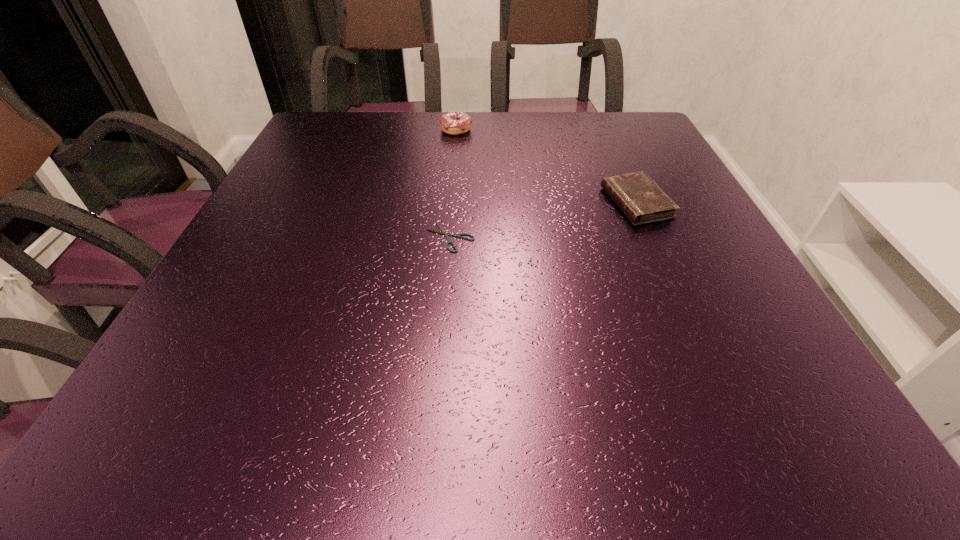
In the image, there is a desktop. Where is `free space at the far edge`? free space at the far edge is located at coordinates (547, 127).

This screenshot has height=540, width=960. I want to click on vacant space at the near edge, so click(x=552, y=414).

Image resolution: width=960 pixels, height=540 pixels. I want to click on vacant area at the left edge of the desktop, so 276,202.

This screenshot has width=960, height=540. In order to click on vacant region at the right edge of the desktop in this screenshot , I will do `click(670, 251)`.

You are a GUI agent. You are given a task and a screenshot of the screen. Output one action in this format:
    pyautogui.click(x=<x>, y=<y>)
    Task: Click on the vacant space at the far right corner of the desktop
    The height and width of the screenshot is (540, 960).
    Given the screenshot: What is the action you would take?
    pyautogui.click(x=631, y=125)

The height and width of the screenshot is (540, 960). Identify the location of vacant area that lies between the doughnut and the diary. (546, 166).

At what (x,y) coordinates should I click in order to perform the action: click on free space between the doughnut and the second shortest object. Please return your answer as a coordinate pair (x, y). Image resolution: width=960 pixels, height=540 pixels. Looking at the image, I should click on (546, 166).

At what (x,y) coordinates should I click in order to perform the action: click on free space between the doughnut and the shears. Please return your answer as a coordinate pair (x, y). This screenshot has height=540, width=960. Looking at the image, I should click on (453, 184).

The height and width of the screenshot is (540, 960). What are the coordinates of `free space between the tallest object and the shears` in the screenshot? It's located at (453, 184).

You are a GUI agent. You are given a task and a screenshot of the screen. Output one action in this format:
    pyautogui.click(x=<x>, y=<y>)
    Task: Click on the empty location between the rightmost object and the tallest object
    This screenshot has width=960, height=540.
    Given the screenshot: What is the action you would take?
    point(546,166)